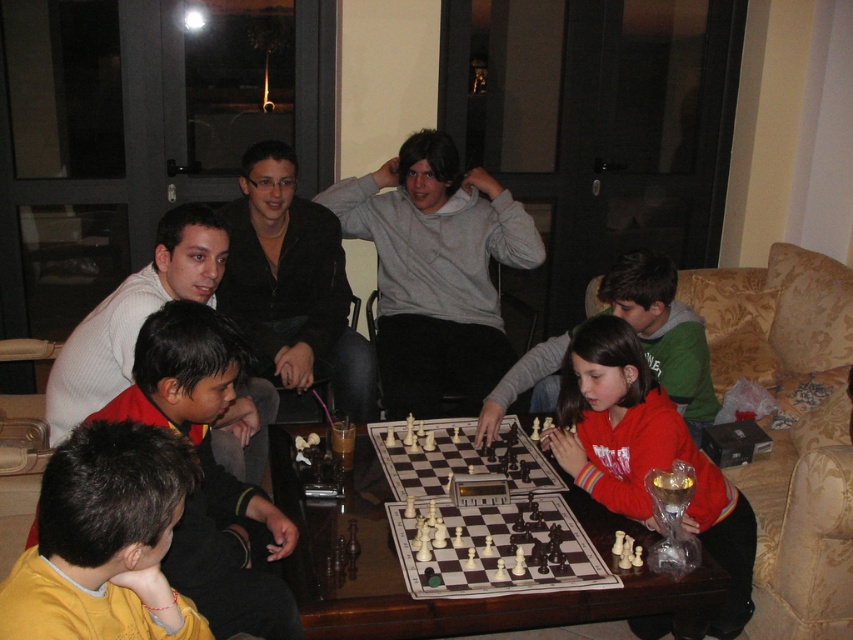
Question: Based on their relative distances, which object is nearer to the white wooden chess set at center?

Choices:
 (A) matte black jacket at upper center
 (B) white matte sweater at upper left

Answer: (B)

Question: Does matte red hoodie at center have a greater width compared to red fleece jacket at center?

Choices:
 (A) no
 (B) yes

Answer: (A)

Question: Among these points, which one is farthest from the camera?

Choices:
 (A) (630, 392)
 (B) (386, 474)
 (C) (442, 445)

Answer: (C)

Question: Can you confirm if white wooden chess set at center is positioned below red fleece jacket at center?

Choices:
 (A) yes
 (B) no

Answer: (A)

Question: Can you confirm if yellow fabric shirt at lower left is wider than matte red hoodie at center?

Choices:
 (A) yes
 (B) no

Answer: (B)

Question: Which object appears closest to the camera in this image?

Choices:
 (A) matte black jacket at upper center
 (B) yellow fabric shirt at lower left
 (C) white plastic chess set at center

Answer: (B)